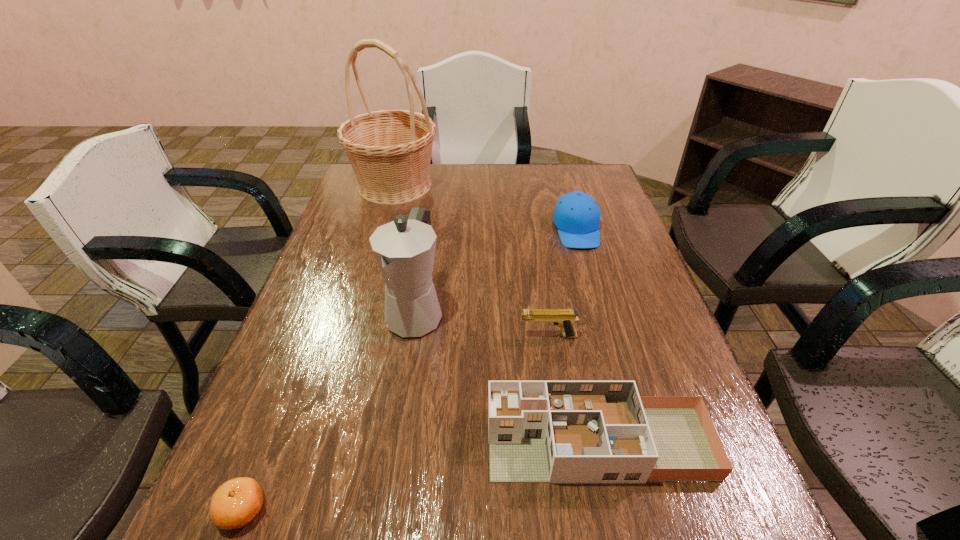
Find the location of a particular element. The image size is (960, 540). the farthest object is located at coordinates (390, 151).

The image size is (960, 540). In order to click on the tallest object in this screenshot , I will do click(x=390, y=151).

The width and height of the screenshot is (960, 540). In order to click on coffeepot in this screenshot , I will do `click(405, 248)`.

Identify the location of cap. This screenshot has width=960, height=540. (576, 215).

Find the location of a particular element. Image resolution: width=960 pixels, height=540 pixels. the fifth farthest object is located at coordinates (538, 431).

You are a GUI agent. You are given a task and a screenshot of the screen. Output one action in this format:
    pyautogui.click(x=<x>, y=<y>)
    Task: Click on the pistol
    The width and height of the screenshot is (960, 540).
    Given the screenshot: What is the action you would take?
    pyautogui.click(x=564, y=318)

This screenshot has height=540, width=960. What are the coordinates of `the shortest object` in the screenshot? It's located at click(x=235, y=503).

Locate an element on the screen. This screenshot has height=540, width=960. clementine is located at coordinates (235, 503).

Where is `vacant space located on the right of the basket`? vacant space located on the right of the basket is located at coordinates (553, 185).

Locate an element on the screen. The height and width of the screenshot is (540, 960). vacant space located 0.230m on the front of the coffeepot is located at coordinates (395, 446).